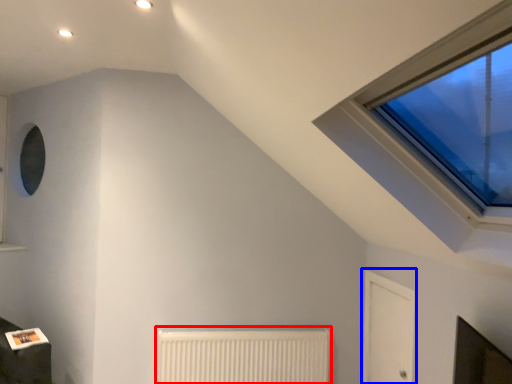
Question: Which object is further to the camera taking this photo, radiator (highlighted by a red box) or glass door (highlighted by a blue box)?

Choices:
 (A) radiator
 (B) glass door

Answer: (A)